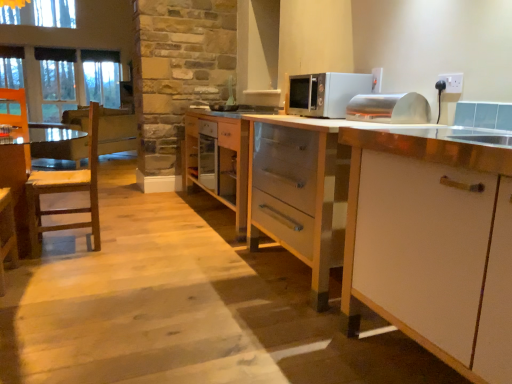
Question: Is point tap(236, 145) closer or farther from the camera than point tap(229, 170)?

Choices:
 (A) farther
 (B) closer

Answer: (B)

Question: From the image's perspective, is wooden cabinet at center, placed as the third cabinetry when sorted from front to back, positioned above or below white wood drawer at center?

Choices:
 (A) below
 (B) above

Answer: (A)

Question: Estimate the real-world distances between objects in this image. Which object is closer to the satin silver microwave at upper center?

Choices:
 (A) white glossy counter top at center
 (B) white plastic electric outlet at upper right
 (C) white matte cabinet at center, which ranks as the 2th cabinetry in front-to-back order
 (D) wooden cabinet at center, placed as the 1th cabinetry when sorted from back to front
 (E) white matte cabinet at right, which ranks as the 1th cabinetry in front-to-back order

Answer: (C)

Question: Estimate the real-world distances between objects in this image. Which object is closer to the wooden chair at left?

Choices:
 (A) white matte cabinet at center, placed as the 2th cabinetry when sorted from back to front
 (B) white plastic electric outlet at upper right
 (C) satin silver microwave at upper center
 (D) wooden cabinet at center, placed as the third cabinetry when sorted from front to back
 (E) white glossy counter top at center

Answer: (D)